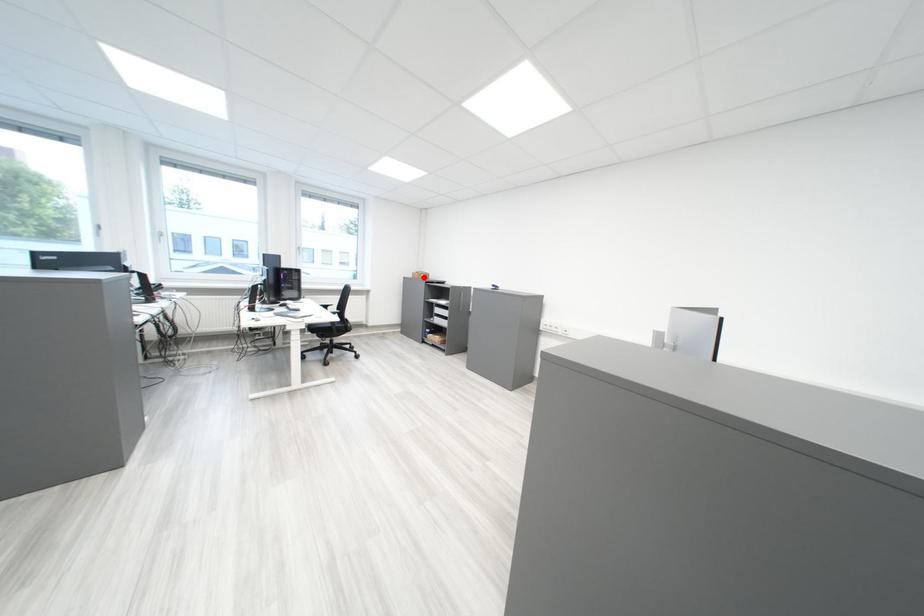
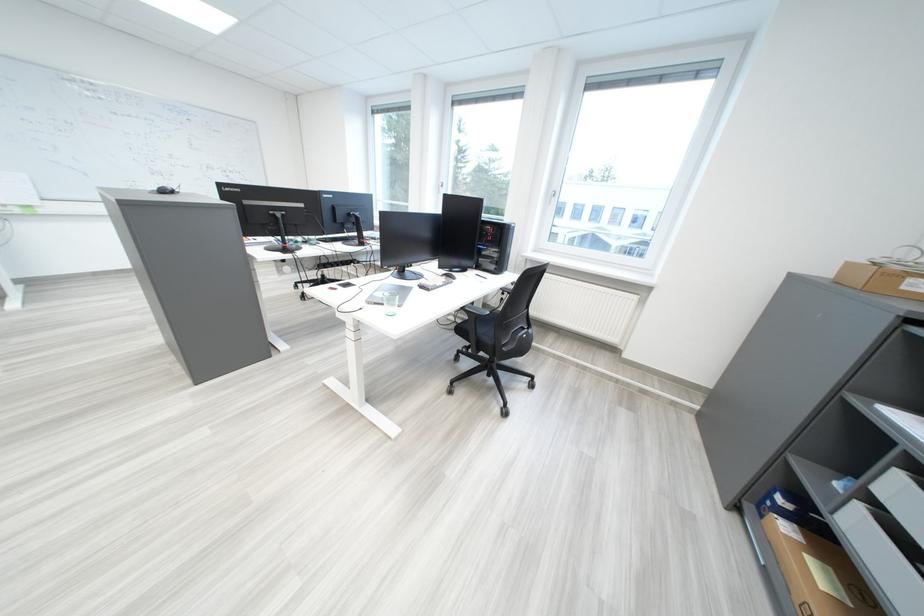
Question: I am providing you with two images of the same scene from different viewpoints. Image1 has a red point marked. In image2, the corresponding 3D location appears at what relative position? Reply with the corresponding letter.

Choices:
 (A) Closer
 (B) Farther

Answer: (B)